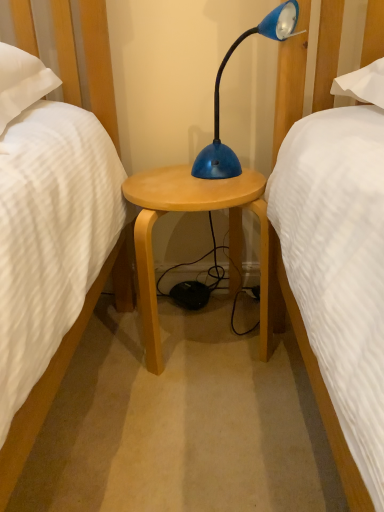
What do you see at coordinates (194, 211) in the screenshot? The image size is (384, 512). I see `light wood stool at center` at bounding box center [194, 211].

The width and height of the screenshot is (384, 512). I want to click on light wood stool at center, so click(194, 211).

Measure the distance between point (235, 247) and camera.

4.29 feet.

In order to face blue glossy desk lamp at center, should I rotate leftwards or rightwards?

You should look right and rotate roughly 5.903 degrees.

This screenshot has height=512, width=384. What do you see at coordinates (218, 94) in the screenshot?
I see `blue glossy desk lamp at center` at bounding box center [218, 94].

Find the location of a particular element. This screenshot has width=384, height=512. blue glossy desk lamp at center is located at coordinates (218, 94).

The height and width of the screenshot is (512, 384). In order to click on light wood stool at center in this screenshot , I will do `click(194, 211)`.

Considering the positions of objects blue glossy desk lamp at center and light wood stool at center in the image provided, who is more to the right, blue glossy desk lamp at center or light wood stool at center?

From the viewer's perspective, blue glossy desk lamp at center appears more on the right side.

Consider the image. Is blue glossy desk lamp at center positioned before light wood stool at center?

Yes, it is.

Which point is more forward, (x=292, y=3) or (x=123, y=188)?

The point (x=292, y=3) is more forward.

From the image's perspective, which is above, blue glossy desk lamp at center or light wood stool at center?

blue glossy desk lamp at center appears higher in the image.

From a real-world perspective, who is located lower, blue glossy desk lamp at center or light wood stool at center?

In real-world perspective, light wood stool at center is lower.

Looking at this image, is blue glossy desk lamp at center thinner than light wood stool at center?

Indeed, blue glossy desk lamp at center has a lesser width compared to light wood stool at center.

Does blue glossy desk lamp at center have a lesser height compared to light wood stool at center?

Yes.

Based on their sizes in the image, would you say blue glossy desk lamp at center is bigger or smaller than light wood stool at center?

In the image, blue glossy desk lamp at center appears to be smaller than light wood stool at center.

Based on the photo, is blue glossy desk lamp at center positioned beyond the bounds of light wood stool at center?

Yes.

Is blue glossy desk lamp at center positioned far away from light wood stool at center?

No, blue glossy desk lamp at center is in close proximity to light wood stool at center.

Is blue glossy desk lamp at center positioned with its back to light wood stool at center?

No, blue glossy desk lamp at center's orientation is not away from light wood stool at center.

Find the location of `stool behind the blue glossy desk lamp at center`. stool behind the blue glossy desk lamp at center is located at coordinates (194, 211).

Which is more to the left, light wood stool at center or blue glossy desk lamp at center?

Positioned to the left is light wood stool at center.

Which object is further away from the camera, light wood stool at center or blue glossy desk lamp at center?

light wood stool at center is further from the camera.

Between point (258, 174) and point (279, 15), which one is positioned in front?

The point (279, 15) is closer.

From the image's perspective, is light wood stool at center located above or below blue glossy desk lamp at center?

light wood stool at center is below blue glossy desk lamp at center.

From a real-world perspective, who is located lower, light wood stool at center or blue glossy desk lamp at center?

light wood stool at center.

Which object is thinner, light wood stool at center or blue glossy desk lamp at center?

blue glossy desk lamp at center.

Considering the relative sizes of light wood stool at center and blue glossy desk lamp at center in the image provided, is light wood stool at center shorter than blue glossy desk lamp at center?

No, light wood stool at center is not shorter than blue glossy desk lamp at center.

Can you confirm if light wood stool at center is bigger than blue glossy desk lamp at center?

Indeed, light wood stool at center has a larger size compared to blue glossy desk lamp at center.

Is blue glossy desk lamp at center a part of light wood stool at center?

No.

Is light wood stool at center placed right next to blue glossy desk lamp at center?

light wood stool at center and blue glossy desk lamp at center are clearly separated.

Does light wood stool at center turn towards blue glossy desk lamp at center?

Result: No, light wood stool at center is not turned towards blue glossy desk lamp at center.

How many degrees apart are the facing directions of light wood stool at center and blue glossy desk lamp at center?

The angular difference between light wood stool at center and blue glossy desk lamp at center is 52.2 degrees.

The image size is (384, 512). Identify the location of stool lying below the blue glossy desk lamp at center (from the image's perspective). (194, 211).

Image resolution: width=384 pixels, height=512 pixels. What are the coordinates of `lamp on the right of light wood stool at center` in the screenshot? It's located at (218, 94).

Locate an element on the screen. This screenshot has width=384, height=512. lamp above the light wood stool at center (from a real-world perspective) is located at coordinates (218, 94).